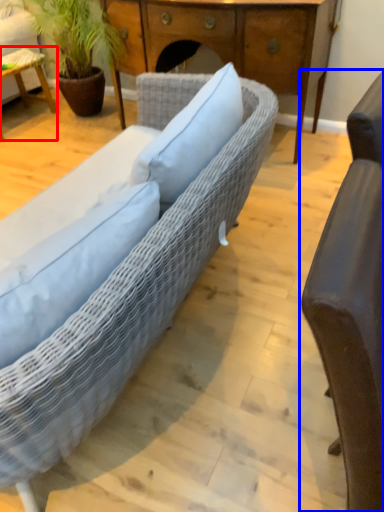
Question: Among these objects, which one is nearest to the camera, table (highlighted by a red box) or chair (highlighted by a blue box)?

Choices:
 (A) table
 (B) chair

Answer: (B)